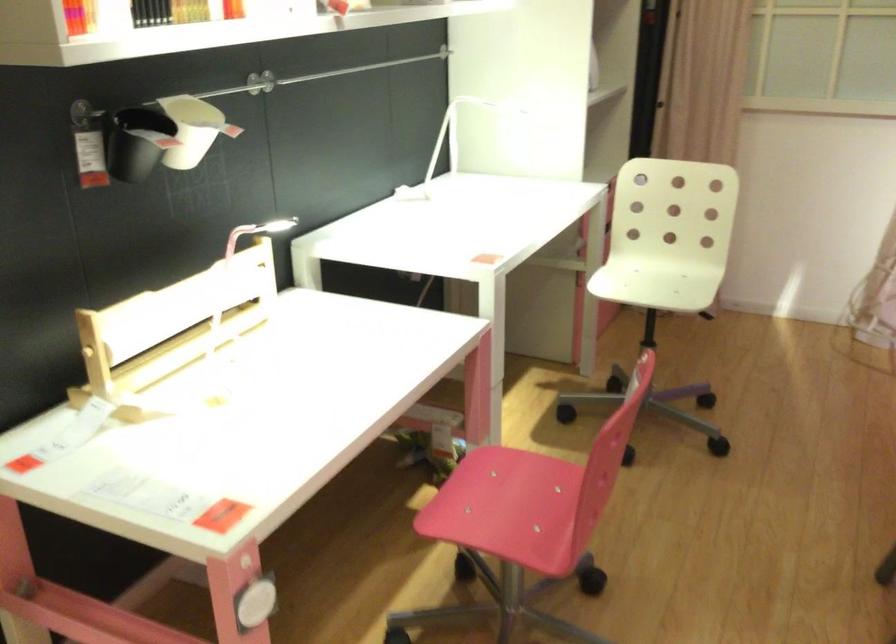
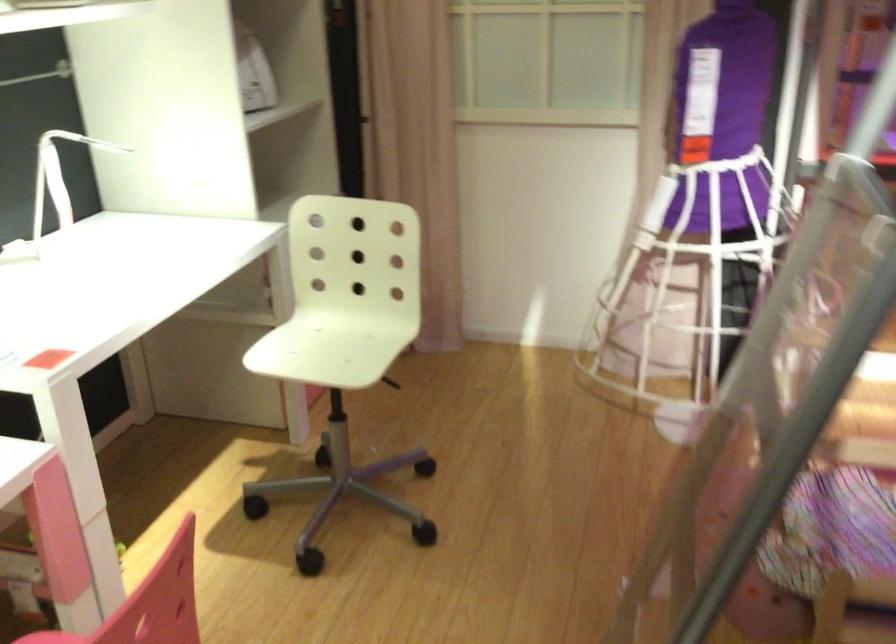
Where in the second image is the point corresponding to (x=659, y=283) from the first image?

(331, 345)